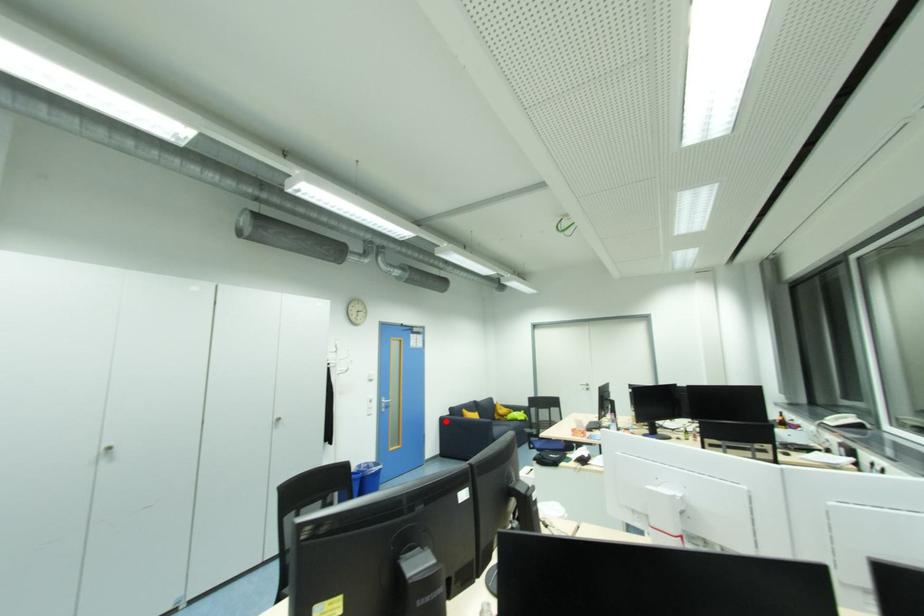
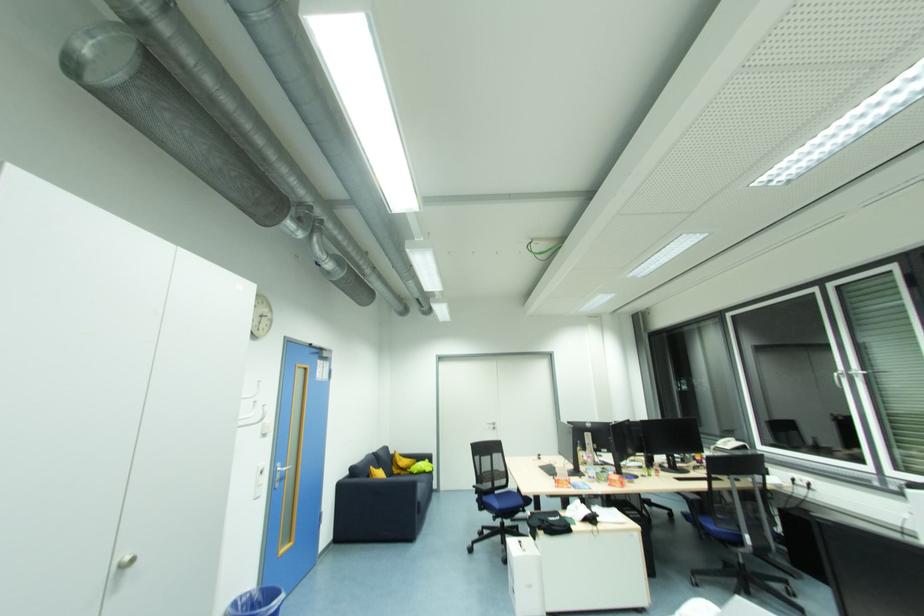
The point at the highlighted location is marked in the first image. Where is the corresponding point in the second image?

(343, 487)